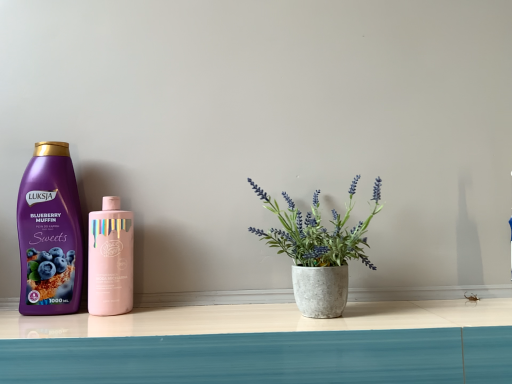
Question: Does pink glossy bottle at center, the first bottle from the right, turn towards purple matte bottle at left, the second bottle viewed from the right?

Choices:
 (A) no
 (B) yes

Answer: (A)

Question: Is pink glossy bottle at center, arranged as the 2th bottle when viewed from the left, at the right side of purple matte bottle at left, positioned as the 1th bottle in left-to-right order?

Choices:
 (A) yes
 (B) no

Answer: (A)

Question: Does pink glossy bottle at center, the first bottle from the right, lie in front of purple matte bottle at left, positioned as the 1th bottle in left-to-right order?

Choices:
 (A) no
 (B) yes

Answer: (B)

Question: From a real-world perspective, is pink glossy bottle at center, the first bottle from the right, below purple matte bottle at left, positioned as the 1th bottle in left-to-right order?

Choices:
 (A) yes
 (B) no

Answer: (A)

Question: Is purple matte bottle at left, the second bottle viewed from the right, inside pink glossy bottle at center, the first bottle from the right?

Choices:
 (A) yes
 (B) no

Answer: (B)

Question: Is pink glossy bottle at center, the first bottle from the right, far away from purple matte bottle at left, the second bottle viewed from the right?

Choices:
 (A) yes
 (B) no

Answer: (B)

Question: Does purple matte bottle at left, the second bottle viewed from the right, appear on the right side of pink glossy bottle at center, the first bottle from the right?

Choices:
 (A) yes
 (B) no

Answer: (B)

Question: Does purple matte bottle at left, the second bottle viewed from the right, appear on the left side of pink glossy bottle at center, the first bottle from the right?

Choices:
 (A) no
 (B) yes

Answer: (B)

Question: From the image's perspective, is purple matte bottle at left, positioned as the 1th bottle in left-to-right order, under pink glossy bottle at center, arranged as the 2th bottle when viewed from the left?

Choices:
 (A) yes
 (B) no

Answer: (B)

Question: Can pink glossy bottle at center, the first bottle from the right, be found inside purple matte bottle at left, positioned as the 1th bottle in left-to-right order?

Choices:
 (A) no
 (B) yes

Answer: (A)

Question: Is purple matte bottle at left, positioned as the 1th bottle in left-to-right order, facing away from pink glossy bottle at center, arranged as the 2th bottle when viewed from the left?

Choices:
 (A) no
 (B) yes

Answer: (A)

Question: Is the position of purple matte bottle at left, the second bottle viewed from the right, more distant than that of pink glossy bottle at center, arranged as the 2th bottle when viewed from the left?

Choices:
 (A) no
 (B) yes

Answer: (B)

Question: Looking at their shapes, would you say pink glossy bottle at center, arranged as the 2th bottle when viewed from the left, is wider or thinner than purple matte bottle at left, positioned as the 1th bottle in left-to-right order?

Choices:
 (A) wide
 (B) thin

Answer: (A)